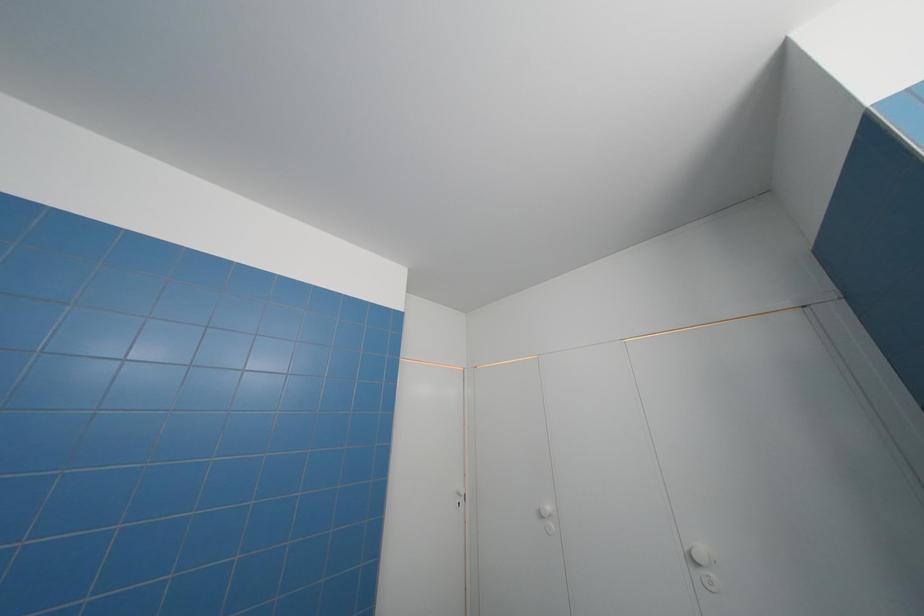
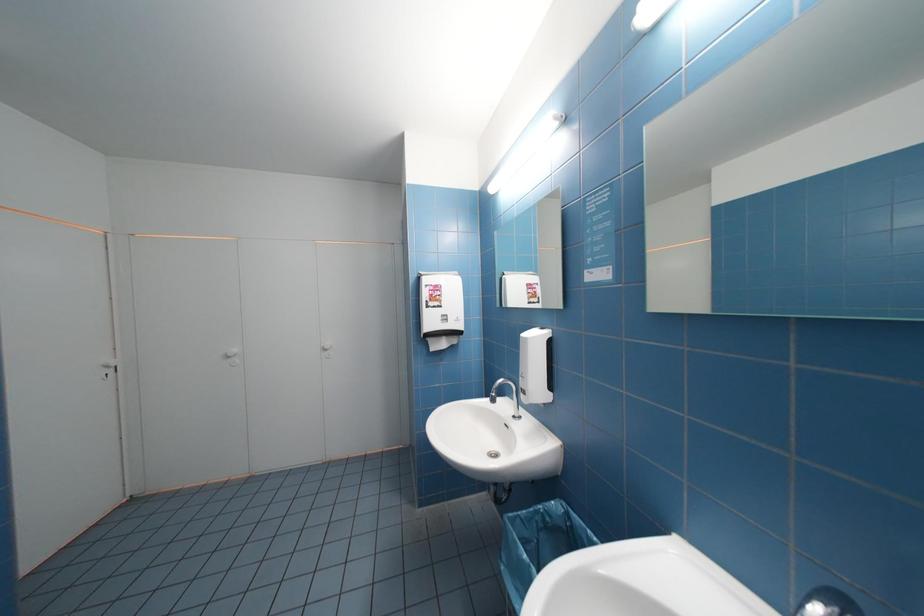
Question: The first image is from the beginning of the video and the second image is from the end. How did the camera likely rotate when shooting the video?

Choices:
 (A) Left
 (B) Right
 (C) Up
 (D) Down

Answer: (B)